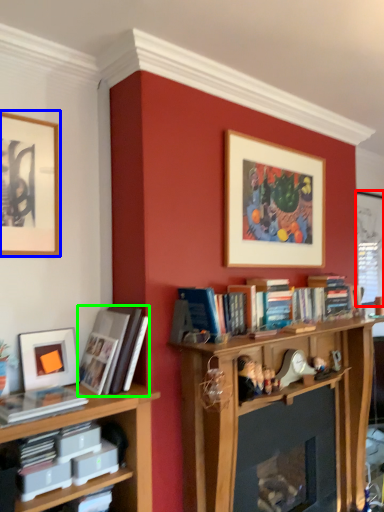
Question: Based on their relative distances, which object is farther from window screen (highlighted by a red box)? Choose from picture frame (highlighted by a blue box) and book (highlighted by a green box).

Choices:
 (A) picture frame
 (B) book

Answer: (A)